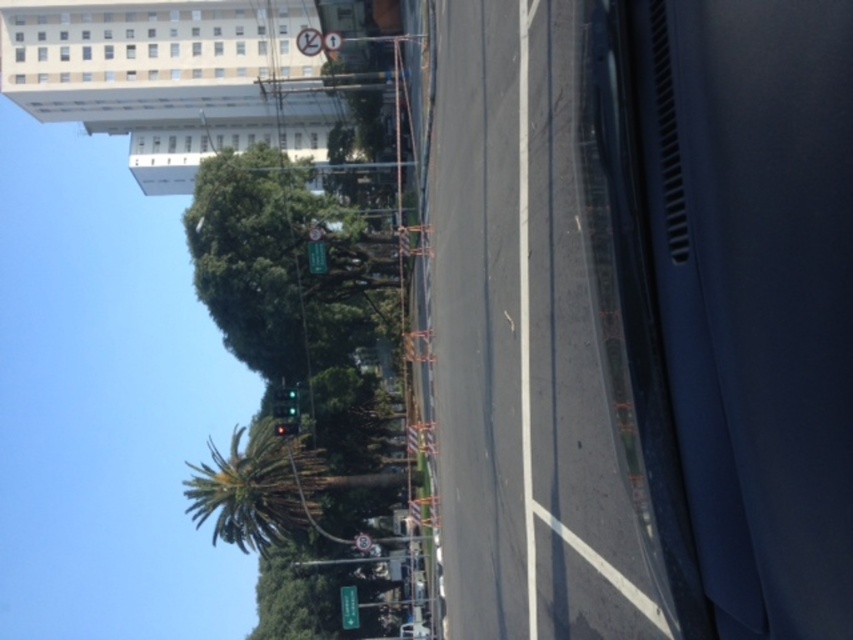
Question: Estimate the real-world distances between objects in this image. Which object is closer to the green leafy palm tree at center?

Choices:
 (A) green leafy tree at center
 (B) green matte street sign at lower center
 (C) green glass traffic light at upper center
 (D) green glass traffic light at center

Answer: (A)

Question: Does green leafy palm tree at center have a larger size compared to green matte street sign at lower center?

Choices:
 (A) no
 (B) yes

Answer: (B)

Question: Which point is closer to the camera taking this photo?

Choices:
 (A) (271, 413)
 (B) (236, 541)

Answer: (A)

Question: Which point is closer to the camera?

Choices:
 (A) green glass traffic light at center
 (B) green leafy palm tree at center
 (C) green leafy tree at center
 (D) green matte street sign at lower center

Answer: (A)

Question: Is green leafy palm tree at center above green matte street sign at lower center?

Choices:
 (A) no
 (B) yes

Answer: (B)

Question: Does green leafy tree at center have a larger size compared to green glass traffic light at center?

Choices:
 (A) yes
 (B) no

Answer: (A)